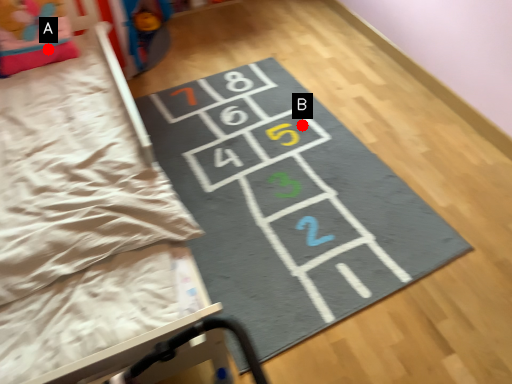
Question: Two points are circled on the image, labeled by A and B beside each circle. Which of the following is the farthest from the observer?

Choices:
 (A) A is further
 (B) B is further

Answer: (B)